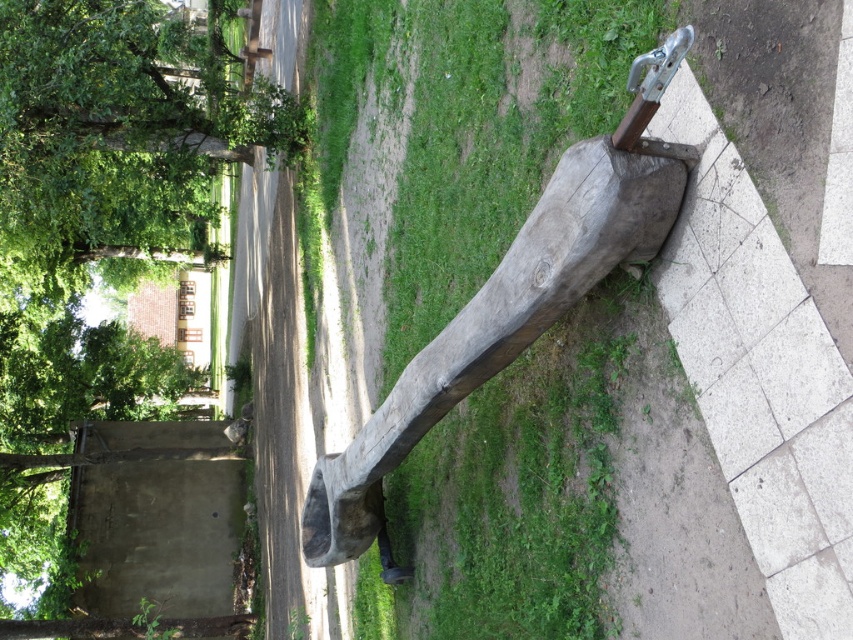
You are a gardener planning to trim the green leafy tree at upper left and move the wooden log at center. Considering their current positions, which object is above the other?

The green leafy tree at upper left is positioned over the wooden log at center, so the green leafy tree at upper left is above the wooden log at center.

You are an artist planning to paint this outdoor scene. You need to decide which object, the green leafy tree at upper left or the wooden log at center, will occupy more horizontal space in your painting. Based on the scene description, which one should you depict as wider?

The green leafy tree at upper left is wider than the wooden log at center, so you should depict the green leafy tree at upper left as occupying more horizontal space in your painting.

You are standing on the paved pathway near the wooden sculpture. You want to walk towards the wooden log at center. Which direction should you go to avoid walking through the green leafy tree at upper left?

Since the wooden log at center is behind the green leafy tree at upper left, you should walk around the tree to reach the wooden log at center without going through the tree.